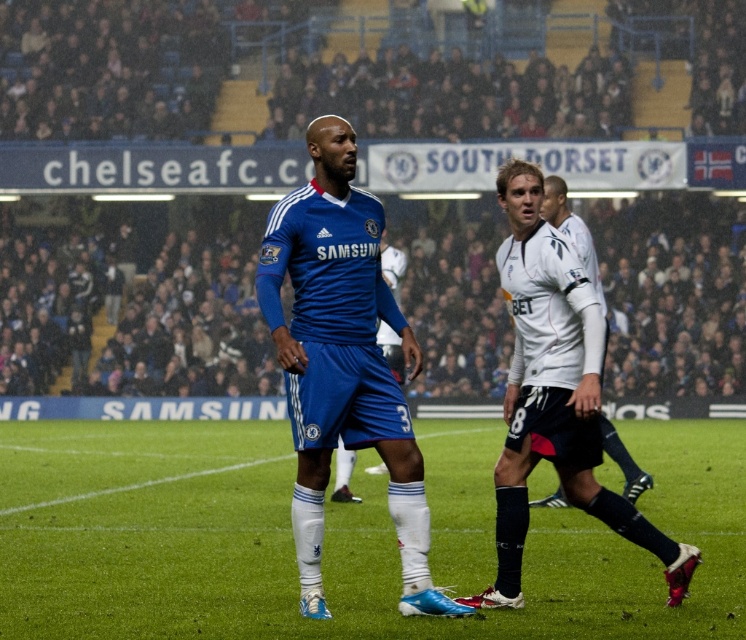
Measure the distance from blue jersey at center to matte blue jersey at center.

blue jersey at center is 36.55 inches away from matte blue jersey at center.

Does point (310, 552) lie in front of point (304, 432)?

No, (310, 552) is behind (304, 432).

Is point (533, 228) positioned behind point (272, 316)?

That is True.

This screenshot has width=746, height=640. In order to click on blue jersey at center in this screenshot , I will do `click(557, 419)`.

Is blue jersey at center above white jersey at center?

Yes.

The height and width of the screenshot is (640, 746). I want to click on blue jersey at center, so click(x=557, y=419).

Does point (307, 435) lie behind point (554, 209)?

No, it is in front of (554, 209).

Does matte blue jersey at center have a smaller size compared to white jersey at center?

No, matte blue jersey at center is not smaller than white jersey at center.

This screenshot has width=746, height=640. Find the location of `matte blue jersey at center`. matte blue jersey at center is located at coordinates (342, 360).

Where is `matte blue jersey at center`? The height and width of the screenshot is (640, 746). matte blue jersey at center is located at coordinates (342, 360).